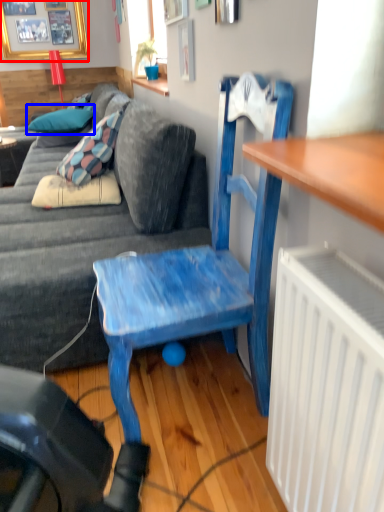
Question: Which object is further to the camera taking this photo, picture frame (highlighted by a red box) or pillow (highlighted by a blue box)?

Choices:
 (A) picture frame
 (B) pillow

Answer: (A)